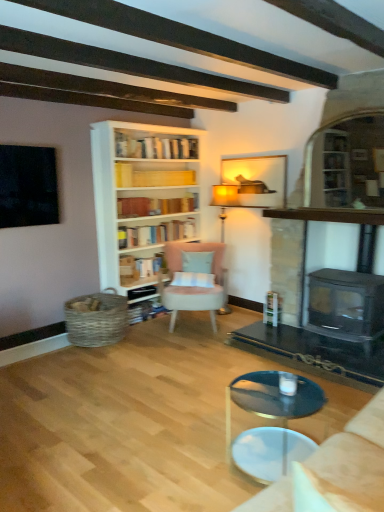
Question: Is matte gold floor lamp at center wider or thinner than yellow paper at upper center, which is counted as the fourth book, starting from the bottom?

Choices:
 (A) thin
 (B) wide

Answer: (B)

Question: From the image's perspective, is matte gold floor lamp at center above or below yellow paper at upper center, which is counted as the fourth book, starting from the bottom?

Choices:
 (A) above
 (B) below

Answer: (B)

Question: Estimate the real-world distances between objects in this image. Which object is closer to the light blue fabric pillow at center?

Choices:
 (A) yellow paper at upper center, which is counted as the fourth book, starting from the bottom
 (B) beige fabric studio couch at lower right
 (C) black glass fireplace at right
 (D) matte wooden picture frame at upper center
 (E) hardcover books at center, which appears as the third book when ordered from the bottom

Answer: (E)

Question: Estimate the real-world distances between objects in this image. Which object is closer to the hardcover book at center, marked as the 3th book in a top-to-bottom arrangement?

Choices:
 (A) matte gold floor lamp at center
 (B) pink fabric chair at center
 (C) matte wooden picture frame at upper center
 (D) beige fabric studio couch at lower right
 (E) light blue fabric pillow at center

Answer: (B)